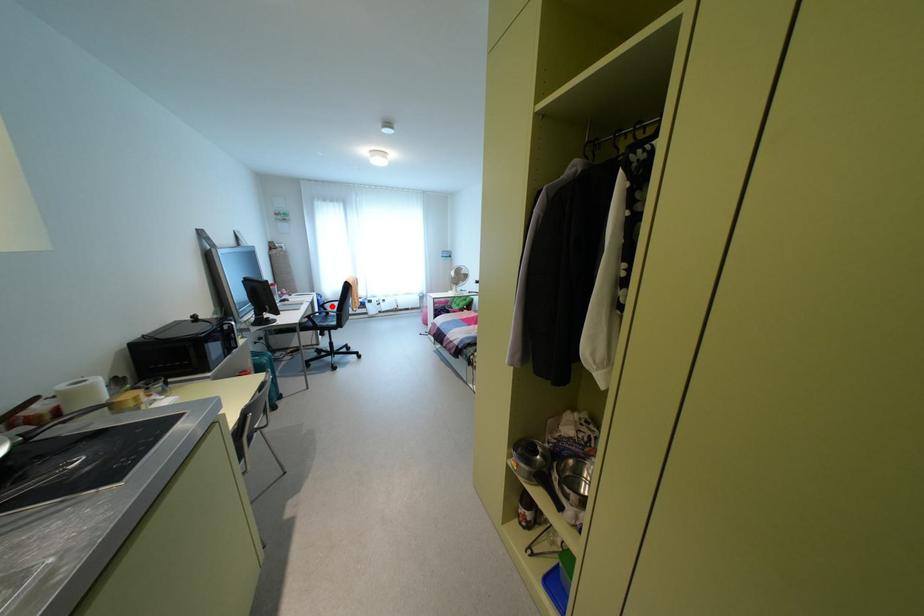
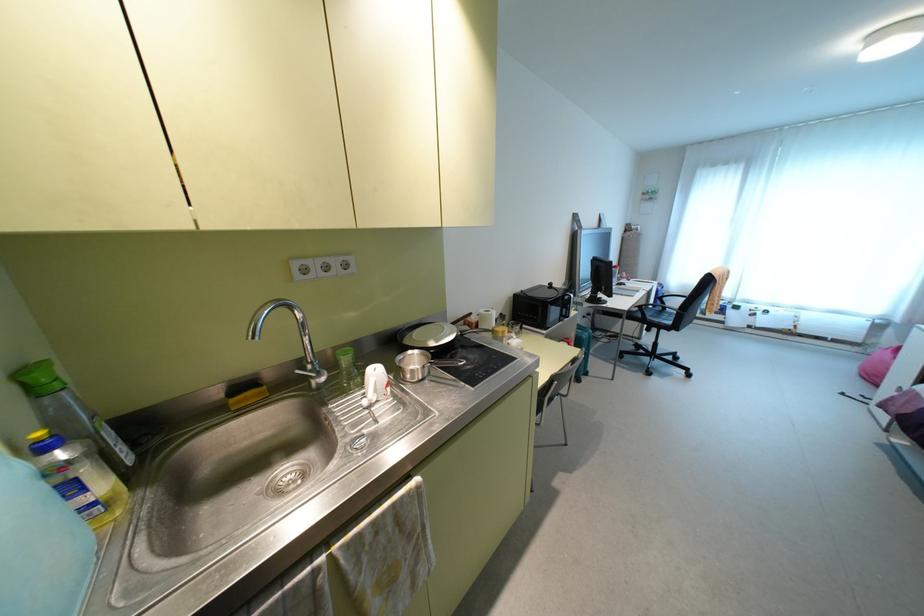
Question: I am providing you with two images of the same scene from different viewpoints. A red point is shown in image1. For the corresponding object point in image2, is it positioned nearer or farther from the camera?

Choices:
 (A) Nearer
 (B) Farther

Answer: (B)